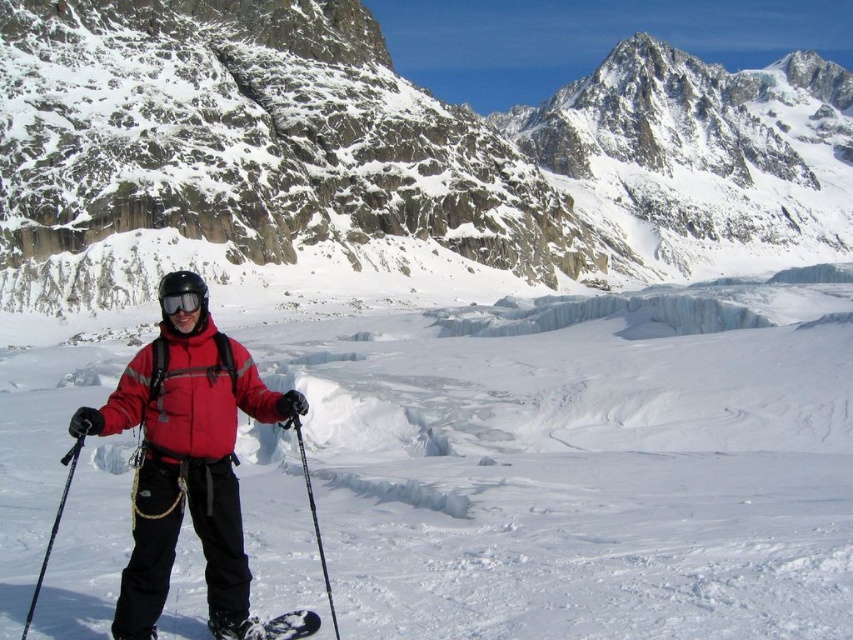
Between point (164, 529) and point (289, 419), which one is positioned behind?

The point (289, 419) is more distant.

Looking at this image, is red matte jacket at center bigger than black matte ski pole at center?

Correct, red matte jacket at center is larger in size than black matte ski pole at center.

Does point (235, 477) come farther from viewer compared to point (300, 452)?

No, (235, 477) is in front of (300, 452).

Where is `red matte jacket at center`? The image size is (853, 640). red matte jacket at center is located at coordinates (184, 458).

Is black matte ski pole at center shorter than transparent plastic goggles at center?

Incorrect, black matte ski pole at center's height does not fall short of transparent plastic goggles at center's.

At what (x,y) coordinates should I click in order to perform the action: click on black matte ski pole at center. Please return your answer as a coordinate pair (x, y). This screenshot has height=640, width=853. Looking at the image, I should click on (312, 515).

At what (x,y) coordinates should I click in order to perform the action: click on red fleece jacket at center. Please return your answer as a coordinate pair (x, y). The width and height of the screenshot is (853, 640). Looking at the image, I should click on (190, 394).

Is point (236, 352) positioned in front of point (221, 624)?

No, it is behind (221, 624).

Image resolution: width=853 pixels, height=640 pixels. Identify the location of red fleece jacket at center. (190, 394).